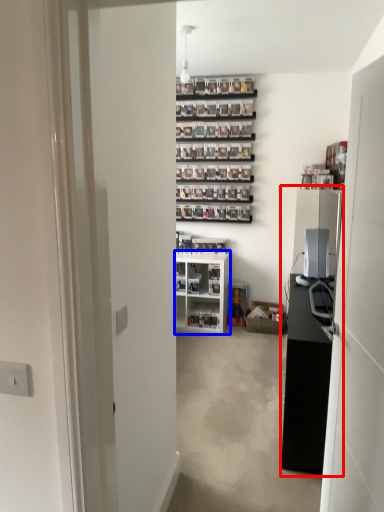
Question: Which object is further to the camera taking this photo, entertainment center (highlighted by a red box) or cabinetry (highlighted by a blue box)?

Choices:
 (A) entertainment center
 (B) cabinetry

Answer: (B)